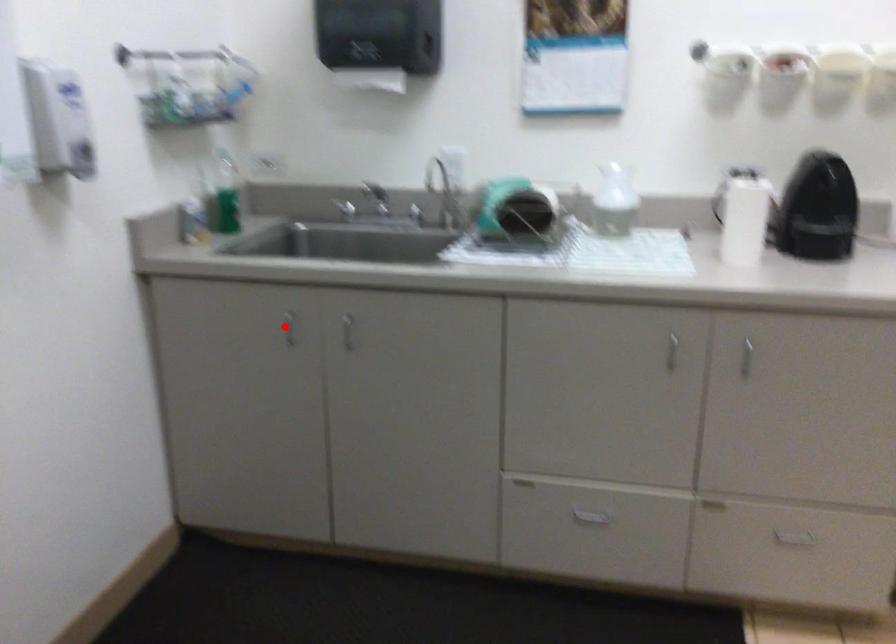
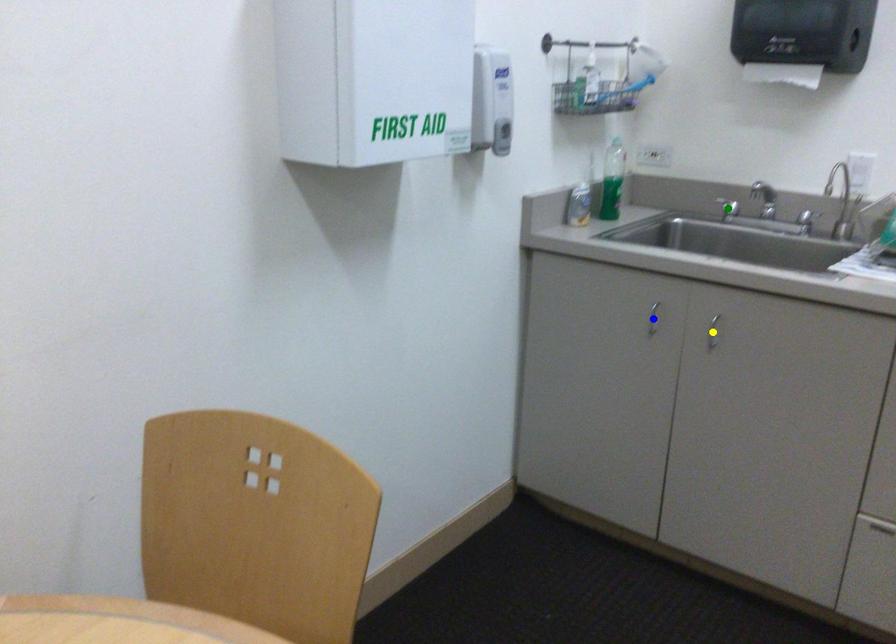
Question: I am providing you with two images of the same scene from different viewpoints. A red point is marked on the first image. You are given multiple points on the second image. Which point in image 2 represents the same 3d spot as the red point in image 1?

Choices:
 (A) yellow point
 (B) blue point
 (C) green point

Answer: (B)